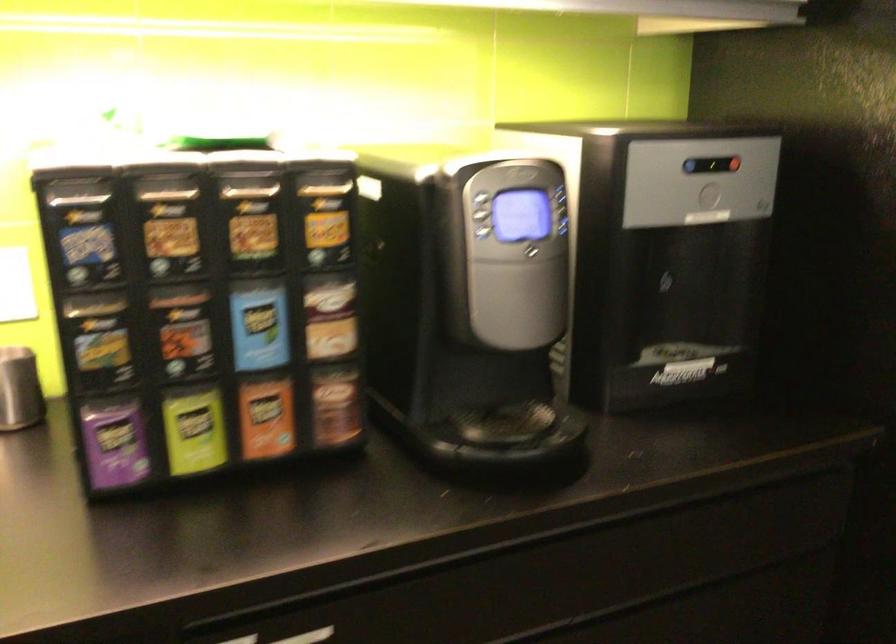
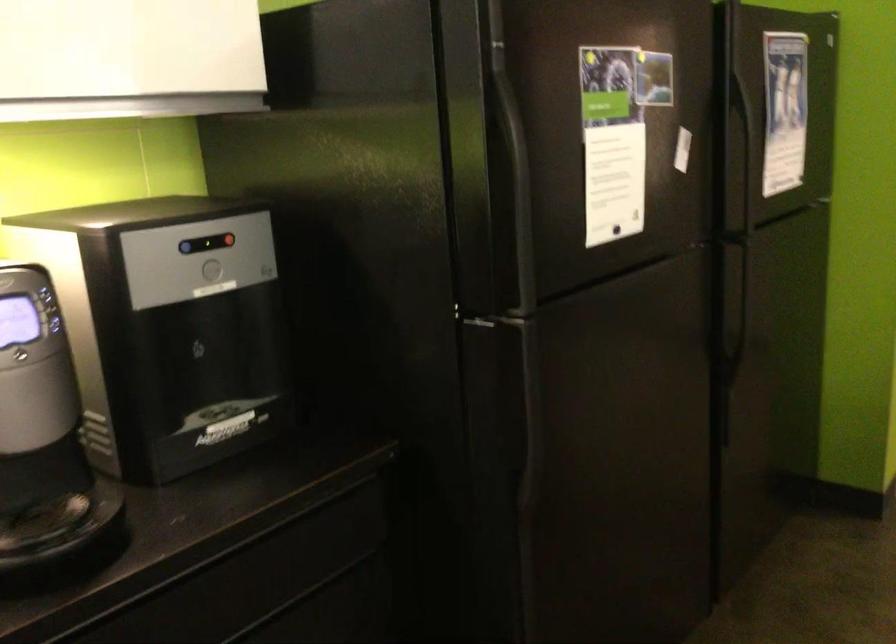
Question: The camera is either moving clockwise (left) or counter-clockwise (right) around the object. The first image is from the beginning of the video and the second image is from the end. Is the camera moving left or right when shooting the video?

Choices:
 (A) Left
 (B) Right

Answer: (A)